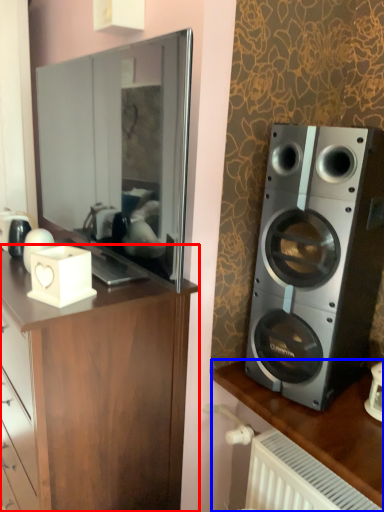
Question: Which point is closer to the camera, cabinetry (highlighted by a red box) or desk (highlighted by a blue box)?

Choices:
 (A) cabinetry
 (B) desk

Answer: (A)